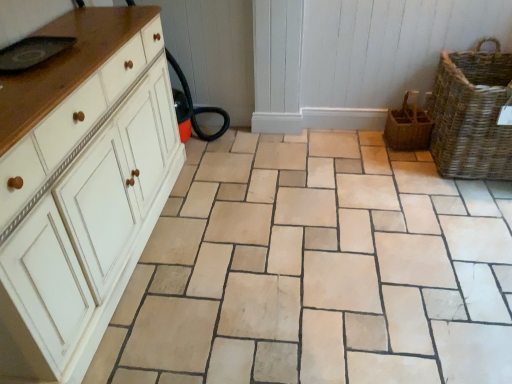
Question: Does woven brown basket at right, the 1th basket viewed from the right, turn towards white painted wood chest of drawers at left?

Choices:
 (A) yes
 (B) no

Answer: (B)

Question: Does woven brown basket at right, placed as the second basket when sorted from left to right, appear on the right side of white painted wood chest of drawers at left?

Choices:
 (A) no
 (B) yes

Answer: (B)

Question: Does woven brown basket at right, placed as the second basket when sorted from left to right, have a greater height compared to white painted wood chest of drawers at left?

Choices:
 (A) no
 (B) yes

Answer: (A)

Question: Is woven brown basket at right, placed as the second basket when sorted from left to right, closer to the viewer compared to white painted wood chest of drawers at left?

Choices:
 (A) no
 (B) yes

Answer: (A)

Question: Considering the relative sizes of woven brown basket at right, the 1th basket viewed from the right, and white painted wood chest of drawers at left in the image provided, is woven brown basket at right, the 1th basket viewed from the right, shorter than white painted wood chest of drawers at left?

Choices:
 (A) no
 (B) yes

Answer: (B)

Question: From the image's perspective, is woven brown basket at right, the second basket viewed from the right, located above or below woven brown basket at right, the 1th basket viewed from the right?

Choices:
 (A) below
 (B) above

Answer: (A)

Question: Relative to woven brown basket at right, placed as the second basket when sorted from left to right, is woven brown basket at right, the 1th basket in the left-to-right sequence, in front or behind?

Choices:
 (A) front
 (B) behind

Answer: (B)

Question: In terms of size, does woven brown basket at right, the second basket viewed from the right, appear bigger or smaller than woven brown basket at right, the 1th basket viewed from the right?

Choices:
 (A) small
 (B) big

Answer: (A)

Question: In terms of width, does woven brown basket at right, the 1th basket in the left-to-right sequence, look wider or thinner when compared to woven brown basket at right, placed as the second basket when sorted from left to right?

Choices:
 (A) wide
 (B) thin

Answer: (B)

Question: Based on their positions, is beige stone tile at center located to the left or right of woven brown basket at right, the 1th basket viewed from the right?

Choices:
 (A) right
 (B) left

Answer: (B)

Question: Considering the positions of point (176, 279) and point (481, 84), is point (176, 279) closer or farther from the camera than point (481, 84)?

Choices:
 (A) farther
 (B) closer

Answer: (B)

Question: In terms of height, does beige stone tile at center look taller or shorter compared to woven brown basket at right, placed as the second basket when sorted from left to right?

Choices:
 (A) tall
 (B) short

Answer: (B)

Question: From a real-world perspective, relative to woven brown basket at right, the 1th basket viewed from the right, is beige stone tile at center vertically above or below?

Choices:
 (A) below
 (B) above

Answer: (A)

Question: Is white painted wood chest of drawers at left wider or thinner than woven brown basket at right, the second basket viewed from the right?

Choices:
 (A) thin
 (B) wide

Answer: (B)

Question: Does point (12, 344) appear closer or farther from the camera than point (421, 130)?

Choices:
 (A) farther
 (B) closer

Answer: (B)